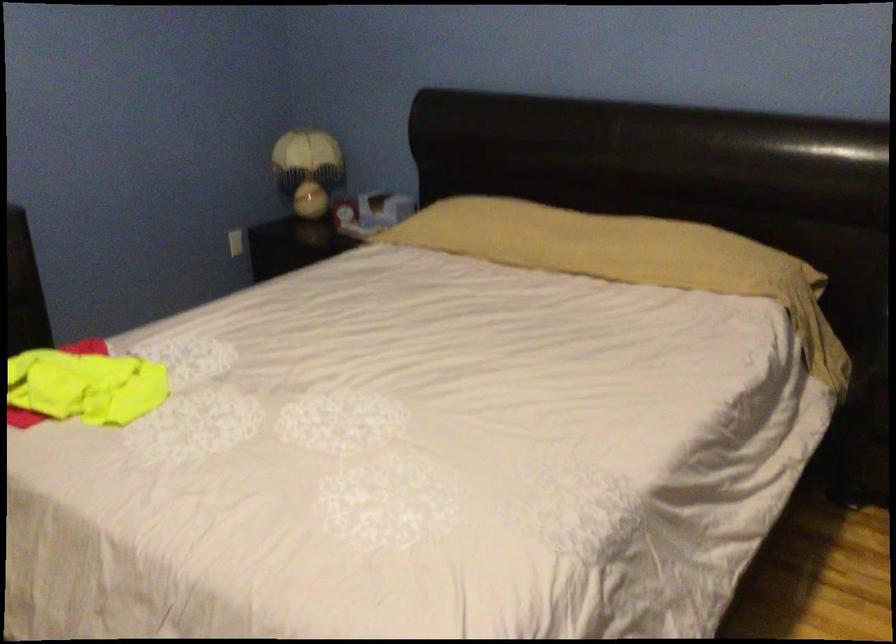
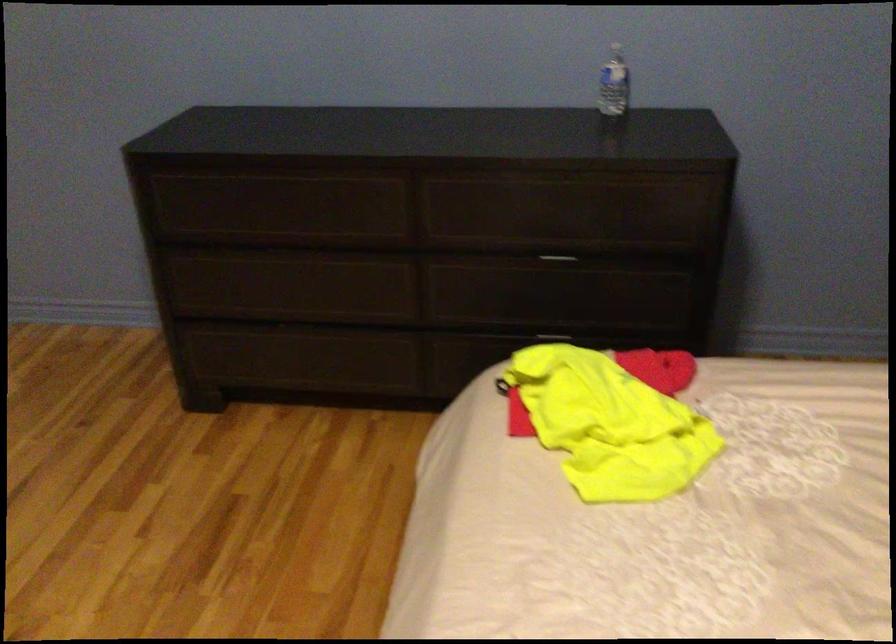
Based on the continuous images, in which direction is the camera rotating?

The camera rotated toward left-down.